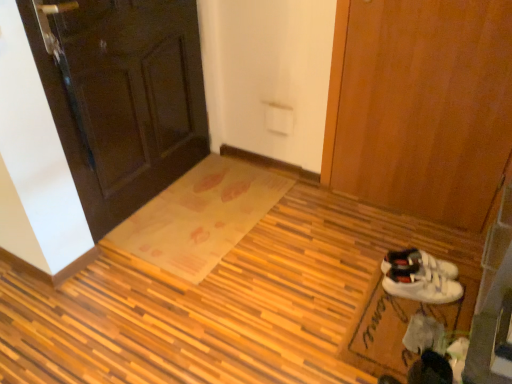
Find the location of `free point above white fabric doormat at lower right, which is the first doormat in right-to-left order (from a real-world perspective)`. free point above white fabric doormat at lower right, which is the first doormat in right-to-left order (from a real-world perspective) is located at coordinates (399, 323).